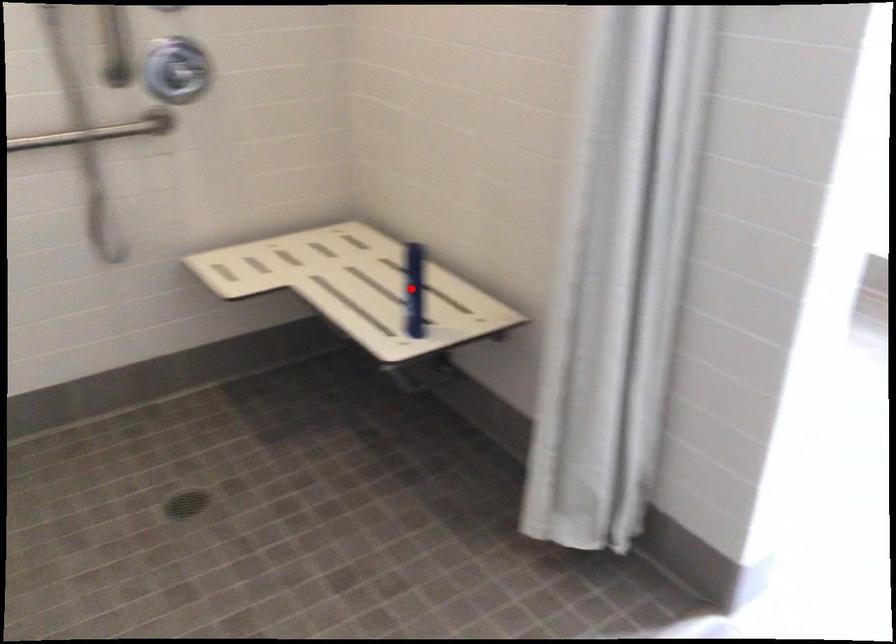
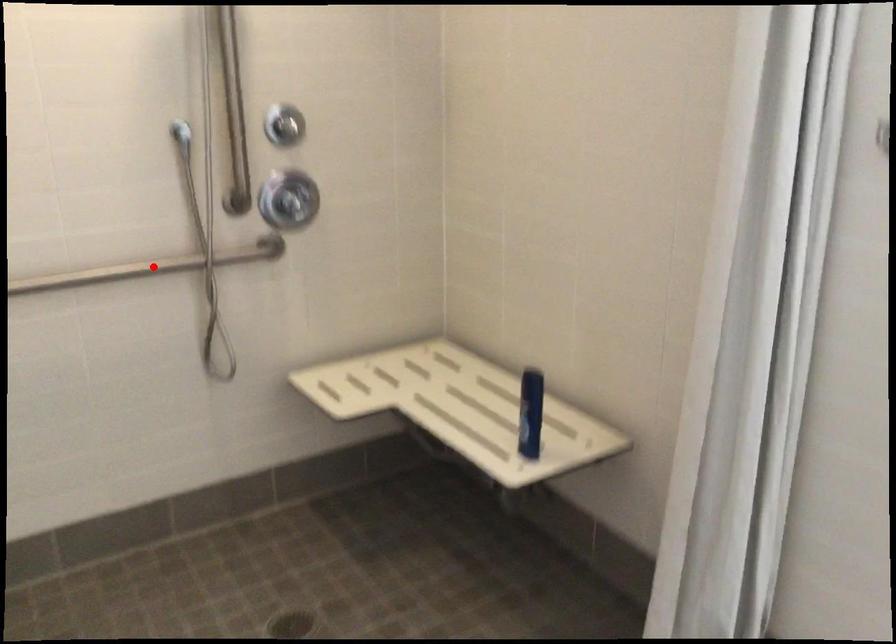
I am providing you with two images of the same scene from different viewpoints. A red point is marked on the first image and another point is marked on the second image. Do the highlighted points in image1 and image2 indicate the same real-world spot?

No